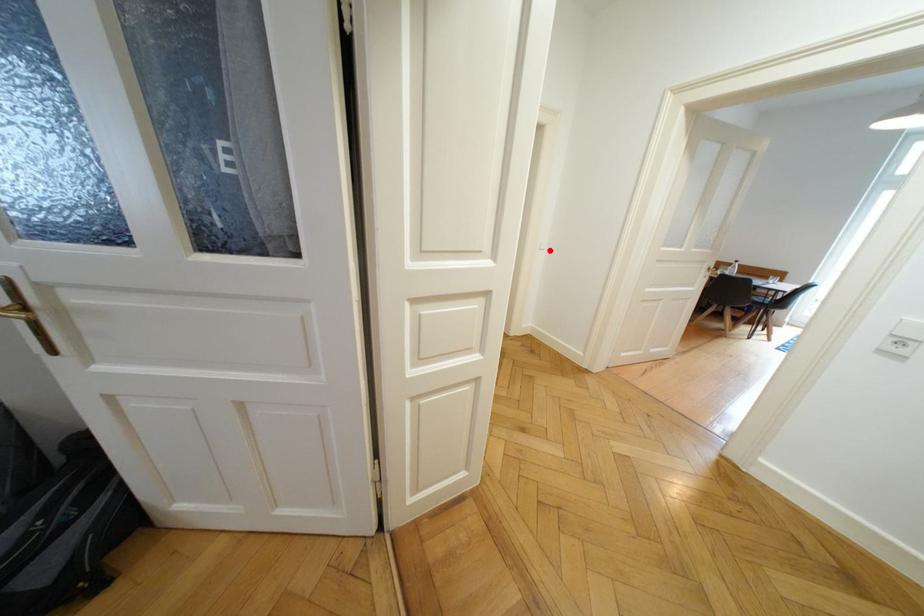
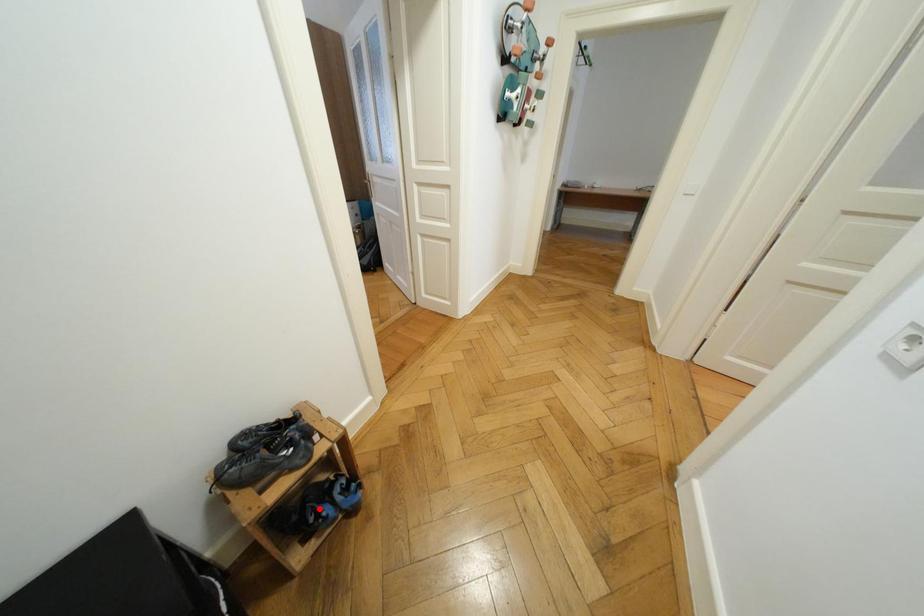
I am providing you with two images of the same scene from different viewpoints. A red point is marked on the first image and another point is marked on the second image. Is the marked point in image1 the same physical position as the marked point in image2?

No